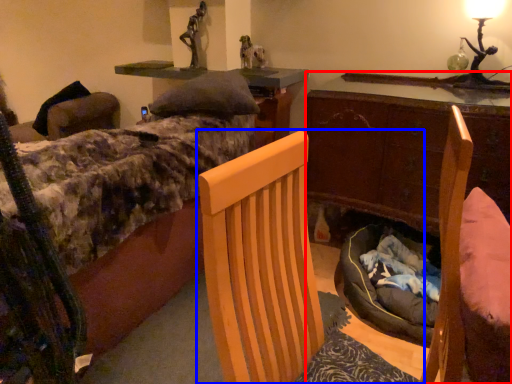
Question: Which of the following is the closest to the observer, desk (highlighted by a red box) or chair (highlighted by a blue box)?

Choices:
 (A) desk
 (B) chair

Answer: (B)